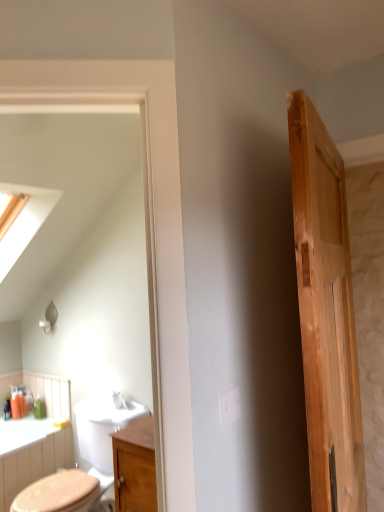
Question: Is natural wood door at right positioned with its back to wooden cabinet at center?

Choices:
 (A) yes
 (B) no

Answer: (A)

Question: From the image's perspective, is natural wood door at right on wooden cabinet at center?

Choices:
 (A) no
 (B) yes

Answer: (B)

Question: Considering the relative sizes of natural wood door at right and wooden cabinet at center in the image provided, is natural wood door at right wider than wooden cabinet at center?

Choices:
 (A) no
 (B) yes

Answer: (A)

Question: From a real-world perspective, is natural wood door at right on wooden cabinet at center?

Choices:
 (A) yes
 (B) no

Answer: (A)

Question: Can you confirm if natural wood door at right is bigger than wooden cabinet at center?

Choices:
 (A) yes
 (B) no

Answer: (A)

Question: Is natural wood door at right behind wooden cabinet at center?

Choices:
 (A) no
 (B) yes

Answer: (A)

Question: Can you confirm if wooden cabinet at center is taller than natural wood door at right?

Choices:
 (A) no
 (B) yes

Answer: (A)

Question: Considering the relative sizes of wooden cabinet at center and natural wood door at right in the image provided, is wooden cabinet at center smaller than natural wood door at right?

Choices:
 (A) yes
 (B) no

Answer: (A)

Question: From a real-world perspective, is wooden cabinet at center physically below natural wood door at right?

Choices:
 (A) yes
 (B) no

Answer: (A)

Question: From the image's perspective, is wooden cabinet at center below natural wood door at right?

Choices:
 (A) no
 (B) yes

Answer: (B)

Question: Is wooden cabinet at center at the right side of natural wood door at right?

Choices:
 (A) no
 (B) yes

Answer: (A)

Question: Is the depth of wooden cabinet at center less than that of natural wood door at right?

Choices:
 (A) yes
 (B) no

Answer: (B)

Question: In terms of height, does wooden cabinet at center look taller or shorter compared to natural wood door at right?

Choices:
 (A) short
 (B) tall

Answer: (A)